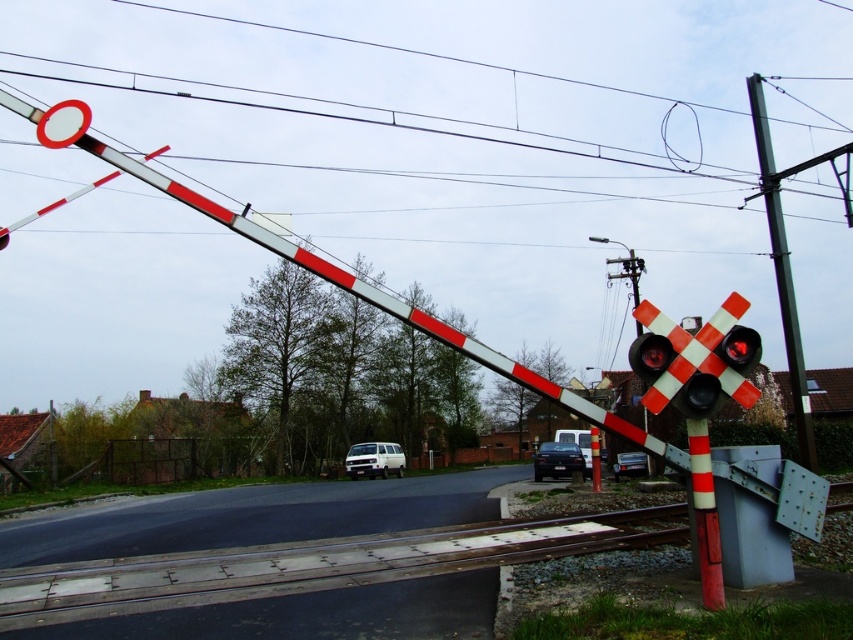
You are a pedestrian standing at the railway crossing and see the metallic gray pole at upper right and the orange painted metal pole at center. Which pole is located to the right of the other?

The metallic gray pole at upper right is positioned on the right side of orange painted metal pole at center.

You are a delivery driver approaching the railway crossing with a truck that has a height of 4 meters. The truck must pass under the metallic gray pole at upper right. Can the truck safely pass under the pole without hitting it?

The distance between the metallic gray pole at upper right and the camera is 14.28 meters, but this information does not provide the height of the pole. Therefore, it is impossible to determine if the truck can safely pass under the pole without hitting it based on the given data.

You are a photographer trying to capture the entire white painted metal power line at upper center and the white matte van at center in a single frame. Which object should you focus on to ensure both are fully visible?

The white painted metal power line at upper center is wider than the white matte van at center, so you should focus on the power line to ensure both are fully visible.